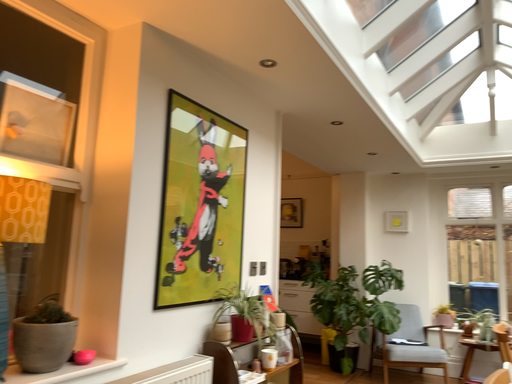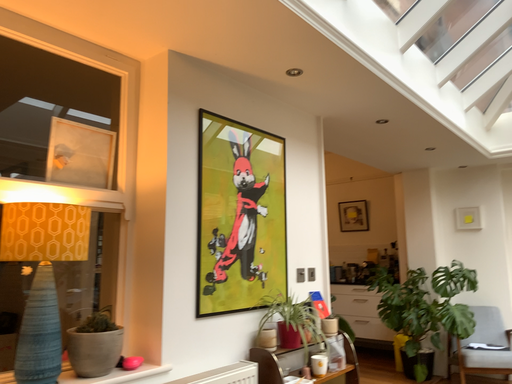
Question: Which way did the camera rotate in the video?

Choices:
 (A) rotated right
 (B) rotated left

Answer: (B)